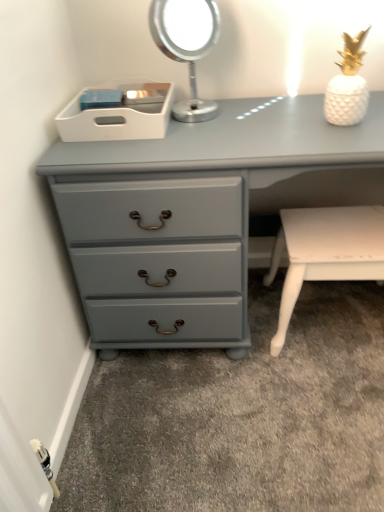
Question: Can you confirm if matte gray chest of drawers at lower left is smaller than white plastic tray at upper center?

Choices:
 (A) no
 (B) yes

Answer: (A)

Question: Is the surface of matte gray chest of drawers at lower left in direct contact with white plastic tray at upper center?

Choices:
 (A) no
 (B) yes

Answer: (A)

Question: Is the depth of matte gray chest of drawers at lower left less than that of white plastic tray at upper center?

Choices:
 (A) no
 (B) yes

Answer: (B)

Question: From a real-world perspective, is matte gray chest of drawers at lower left on white plastic tray at upper center?

Choices:
 (A) yes
 (B) no

Answer: (B)

Question: From the image's perspective, is matte gray chest of drawers at lower left under white plastic tray at upper center?

Choices:
 (A) no
 (B) yes

Answer: (B)

Question: From a real-world perspective, relative to matte gray chest of drawers at lower left, is white glossy table at lower right vertically above or below?

Choices:
 (A) below
 (B) above

Answer: (A)

Question: In the image, is white glossy table at lower right on the left side or the right side of matte gray chest of drawers at lower left?

Choices:
 (A) right
 (B) left

Answer: (A)

Question: Based on their sizes in the image, would you say white glossy table at lower right is bigger or smaller than matte gray chest of drawers at lower left?

Choices:
 (A) big
 (B) small

Answer: (B)

Question: Considering their positions, is white glossy table at lower right located in front of or behind matte gray chest of drawers at lower left?

Choices:
 (A) behind
 (B) front

Answer: (A)

Question: From the image's perspective, is metallic silver mirror at upper center positioned above or below white plastic tray at upper center?

Choices:
 (A) above
 (B) below

Answer: (A)

Question: In the image, is metallic silver mirror at upper center on the left side or the right side of white plastic tray at upper center?

Choices:
 (A) right
 (B) left

Answer: (A)

Question: From a real-world perspective, is metallic silver mirror at upper center above or below white plastic tray at upper center?

Choices:
 (A) above
 (B) below

Answer: (A)

Question: Would you say metallic silver mirror at upper center is inside or outside white plastic tray at upper center?

Choices:
 (A) outside
 (B) inside

Answer: (A)

Question: Based on their sizes in the image, would you say matte gray chest of drawers at lower left is bigger or smaller than metallic silver mirror at upper center?

Choices:
 (A) small
 (B) big

Answer: (B)

Question: Is point (240, 284) closer or farther from the camera than point (205, 53)?

Choices:
 (A) closer
 (B) farther

Answer: (A)